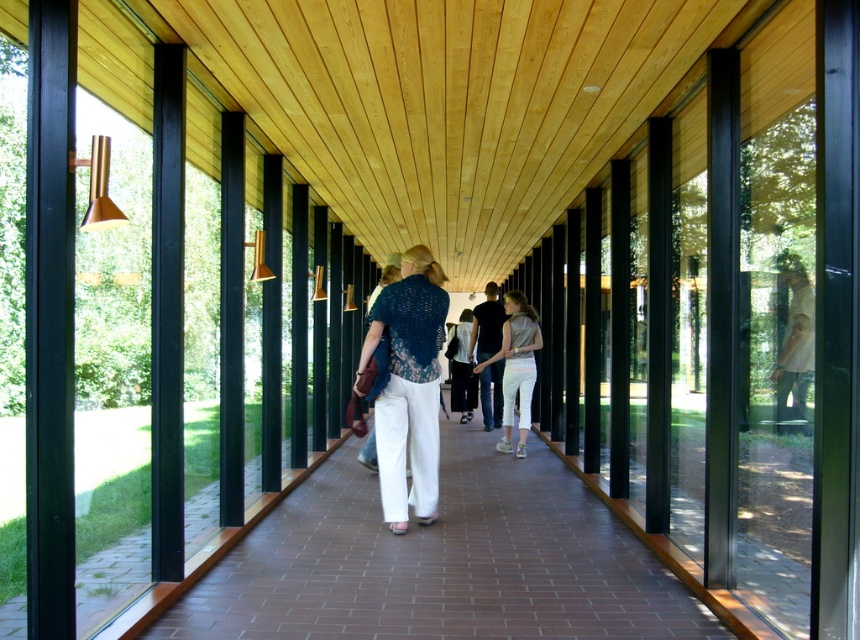
This screenshot has width=860, height=640. What do you see at coordinates (486, 324) in the screenshot? I see `dark blue shirt at center` at bounding box center [486, 324].

Which is behind, point (474, 316) or point (462, 392)?

Positioned behind is point (462, 392).

Does point (495, 321) lie in front of point (453, 337)?

That is True.

In order to click on dark blue shirt at center in this screenshot , I will do `click(486, 324)`.

Between knitted blue blouse at center and dark blue shirt at center, which one is positioned higher?

knitted blue blouse at center is higher up.

Between knitted blue blouse at center and dark blue shirt at center, which one has more height?

dark blue shirt at center is taller.

Find the location of a particular element. The height and width of the screenshot is (640, 860). knitted blue blouse at center is located at coordinates pos(408,387).

Image resolution: width=860 pixels, height=640 pixels. I want to click on knitted blue blouse at center, so (x=408, y=387).

How far apart are brown brick path at center and dark blue shirt at center?

brown brick path at center is 3.17 meters from dark blue shirt at center.

Where is `brown brick path at center`? The image size is (860, 640). brown brick path at center is located at coordinates (441, 561).

Is point (455, 550) positioned after point (484, 328)?

No.

This screenshot has width=860, height=640. What are the coordinates of `brown brick path at center` in the screenshot? It's located at (441, 561).